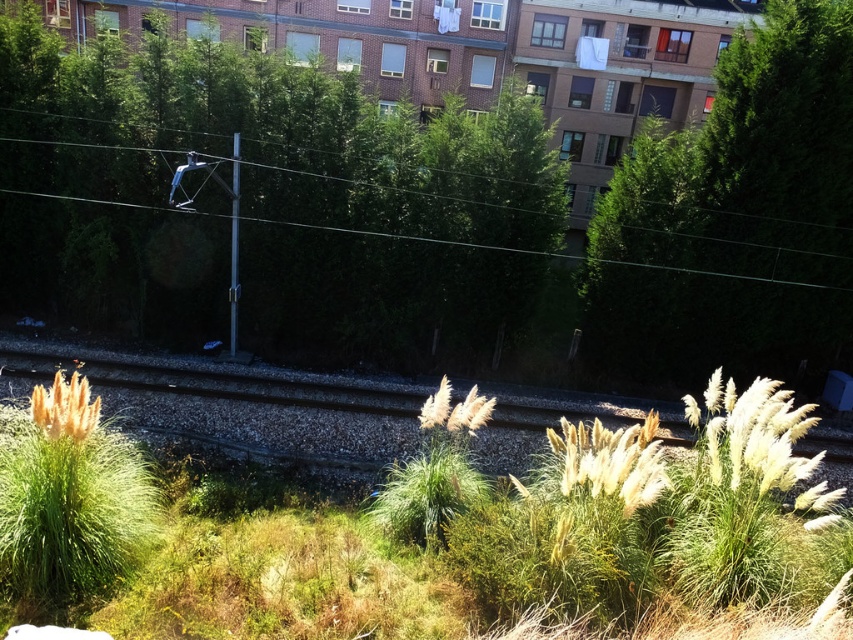
Based on the photo, you are a surveyor measuring distances on a map of the railway scene. The map uses a coordinate system where the bottom left corner is the origin point. Where is the green leafy tree at center located on the map?

The green leafy tree at center is located at coordinates point (x=305, y=188).

You are a bird flying over the railway track and want to land on a tree. You see two green leafy trees in the image. Which tree is positioned higher up in the image, the green leafy tree at center or the green leafy tree at upper center?

The green leafy tree at upper center is positioned higher up in the image than the green leafy tree at center.